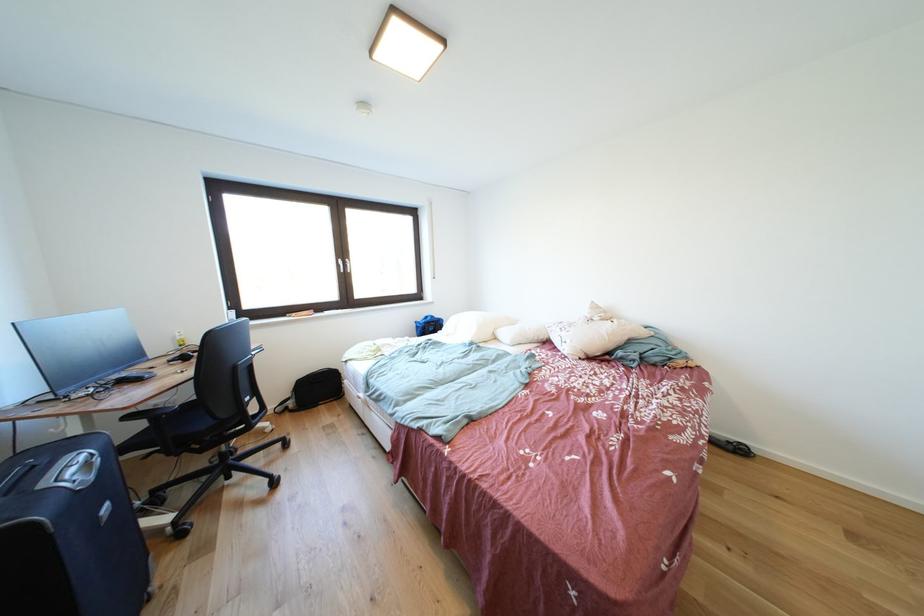
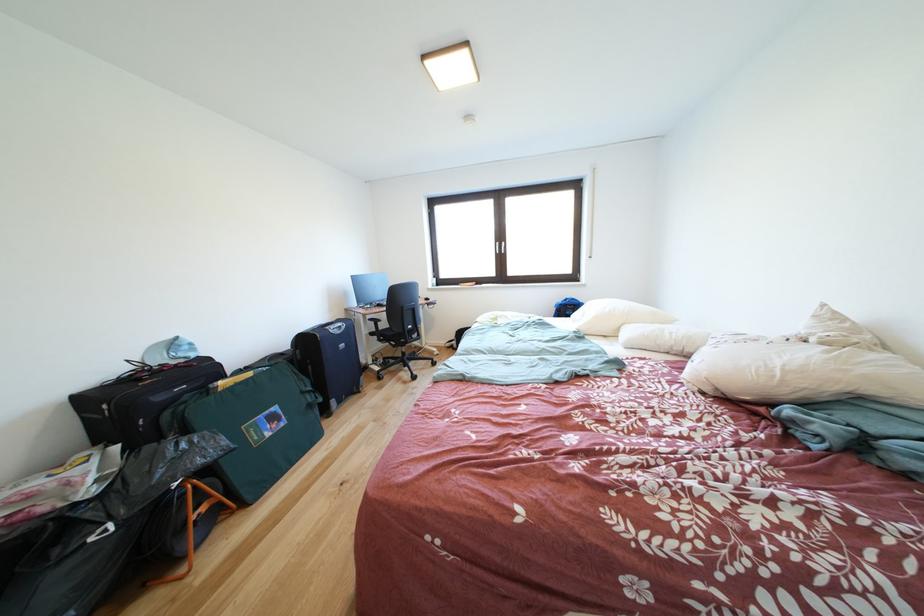
In the second image, find the point that corresponds to [210,455] in the first image.

(403, 351)